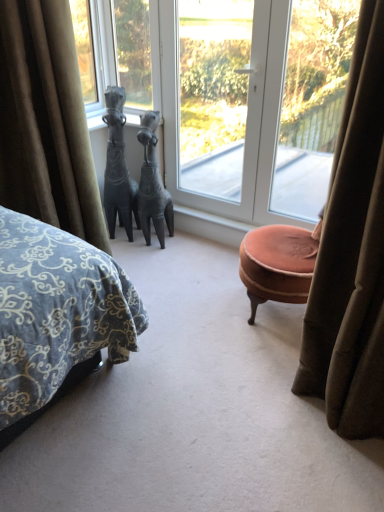
I want to click on vacant space underneath transparent glass door at center (from a real-world perspective), so click(203, 215).